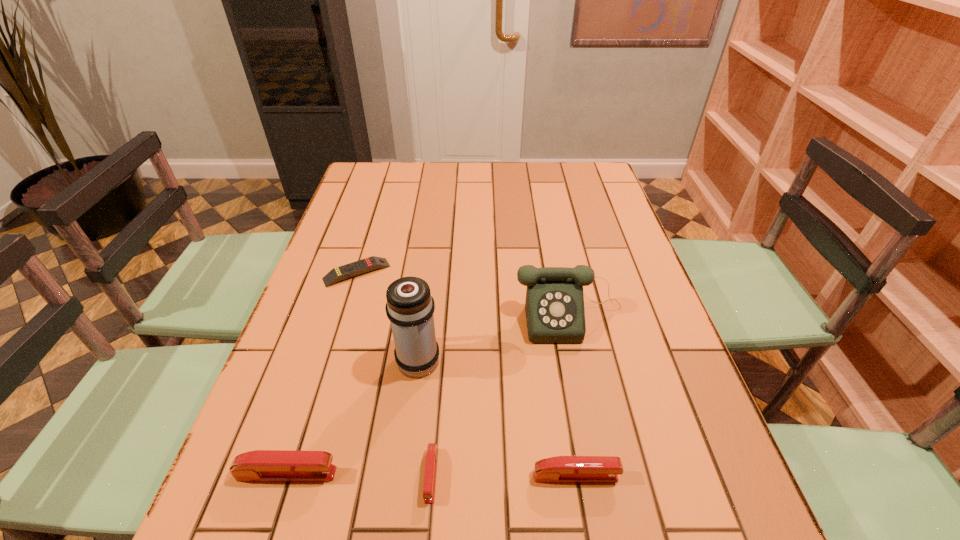
The width and height of the screenshot is (960, 540). What are the coordinates of `vacant space that satisfies the following two spatial constraints: 1. on the dial of the telephone; 2. on the front-facing side of the leftmost stapler` in the screenshot? It's located at (603, 474).